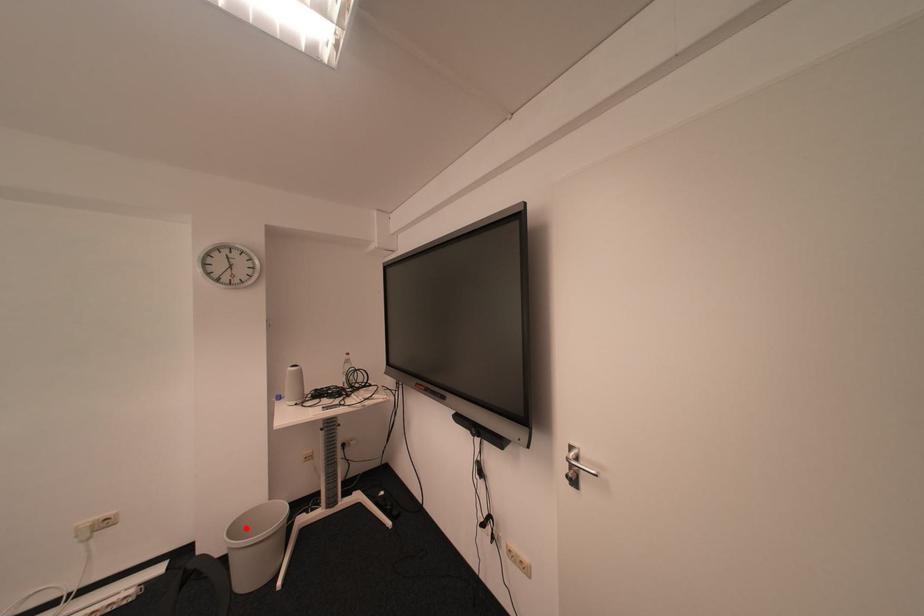
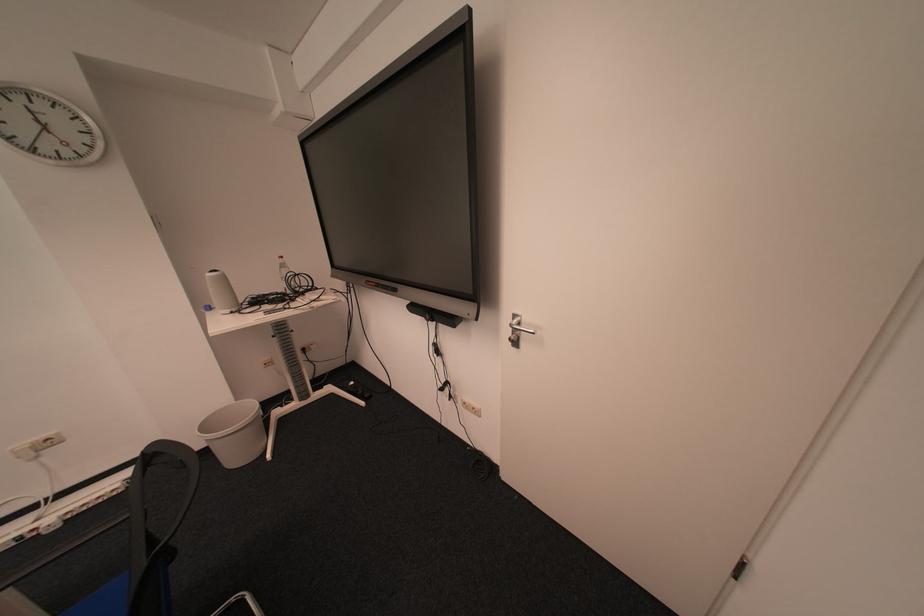
Where in the second image is the point corresponding to the highlighted location from the first image?

(216, 426)